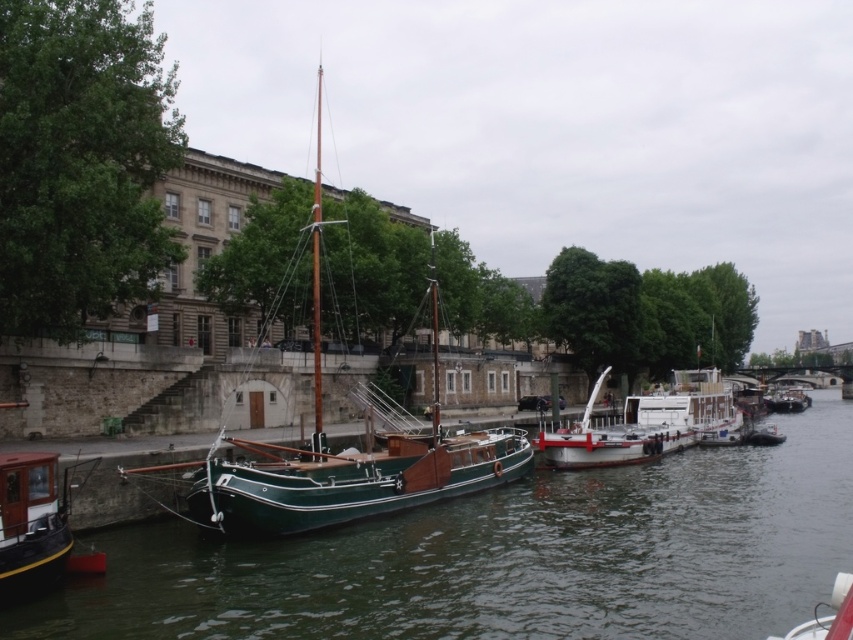
Question: Is green polished wood sailboat at center to the left of white glossy boat at lower right from the viewer's perspective?

Choices:
 (A) yes
 (B) no

Answer: (A)

Question: Which point appears closest to the camera in this image?

Choices:
 (A) (32, 579)
 (B) (437, 397)
 (C) (781, 630)
 (D) (792, 404)

Answer: (A)

Question: Is green wooden boat at center to the right of white matte boat at center from the viewer's perspective?

Choices:
 (A) yes
 (B) no

Answer: (A)

Question: Is green wooden boat at center wider than brushed metal boat at lower left?

Choices:
 (A) no
 (B) yes

Answer: (B)

Question: Which object is positioned closest to the green wooden boat at center?

Choices:
 (A) white matte boat at center
 (B) green polished wood sailboat at center
 (C) green wooden boat at right

Answer: (A)

Question: Which of the following is the closest to the observer?

Choices:
 (A) (767, 403)
 (B) (850, 573)
 (C) (604, 433)

Answer: (B)